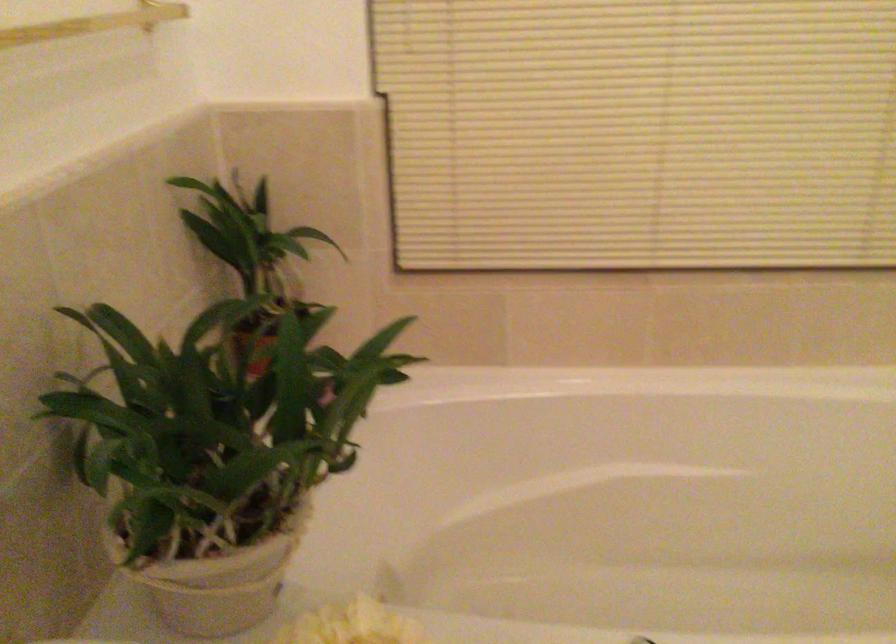
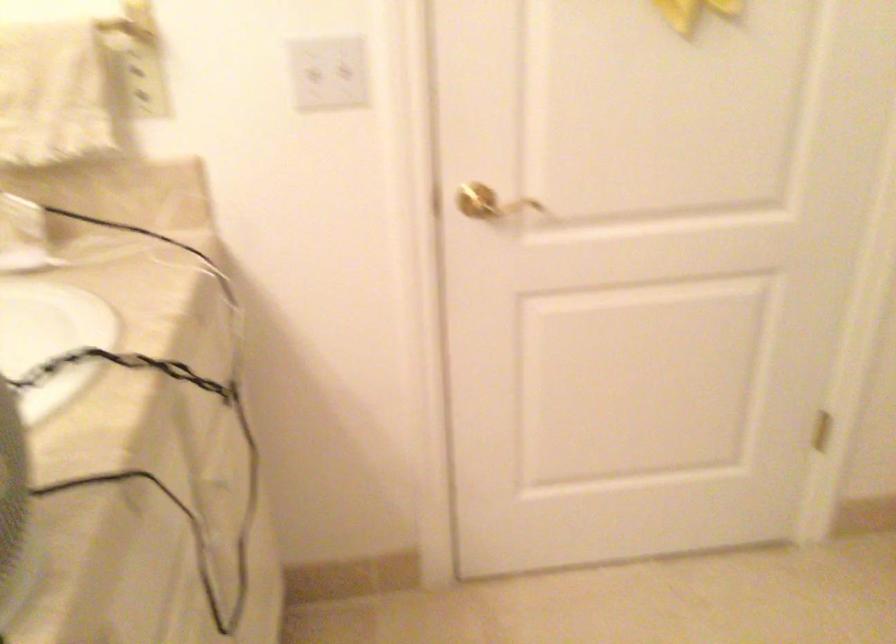
How did the camera likely rotate?

The camera's rotation is toward left-down.